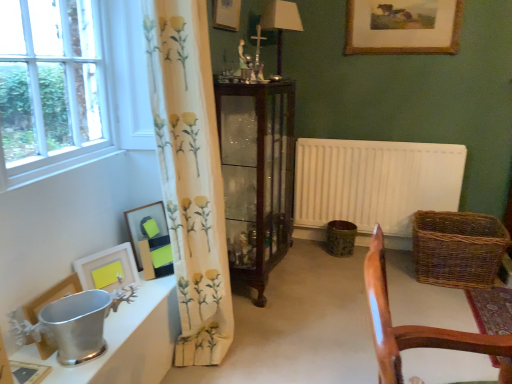
Question: From a real-world perspective, is gold-framed painting at upper center, which is counted as the 6th picture frame, starting from the bottom, positioned above or below dark wood cabinet at center?

Choices:
 (A) above
 (B) below

Answer: (A)

Question: Is gold-framed painting at upper center, which is counted as the first picture frame, starting from the top, to the left or to the right of dark wood cabinet at center in the image?

Choices:
 (A) left
 (B) right

Answer: (B)

Question: Which of these objects is positioned farthest from the matte wooden picture frame at upper center, acting as the 5th picture frame starting from the front?

Choices:
 (A) gold-framed painting at upper center, placed as the sixth picture frame when sorted from left to right
 (B) yellow floral fabric curtain at left
 (C) dark wood cabinet at center
 (D) white matte picture frame at lower left, the third picture frame when ordered from left to right
 (E) brown woven basket at lower right

Answer: (E)

Question: Estimate the real-world distances between objects in this image. Which object is farther from the metallic silver picture frame at lower left, which is the second picture frame in left-to-right order?

Choices:
 (A) clear glass window at left
 (B) dark wood cabinet at center
 (C) white matte picture frame at lower left, which is the fourth picture frame from top to bottom
 (D) white matte radiator at center right
 (E) matte wooden picture frame at upper center, the second picture frame viewed from the right

Answer: (D)